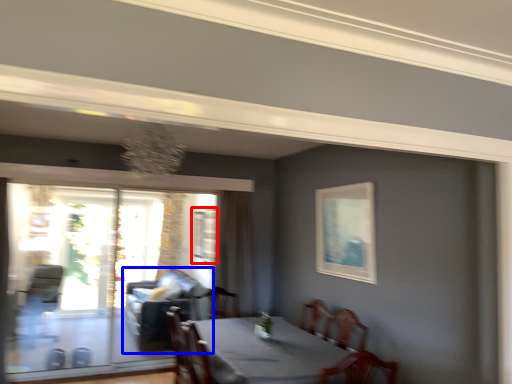
Question: Which object is closer to the camera taking this photo, window (highlighted by a red box) or couch (highlighted by a blue box)?

Choices:
 (A) window
 (B) couch

Answer: (B)